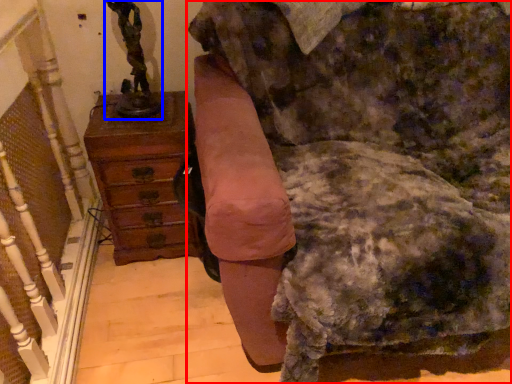
Question: Which point is closer to the camera, furniture (highlighted by a red box) or sculpture (highlighted by a blue box)?

Choices:
 (A) furniture
 (B) sculpture

Answer: (A)